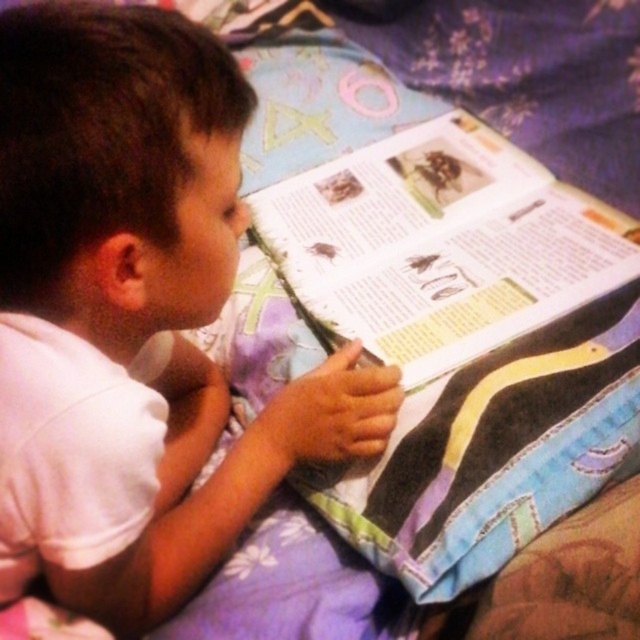
In order to click on white matte shirt at upper left in this screenshot , I will do `click(150, 276)`.

Which of these two, white matte shirt at upper left or paperback book at center, stands taller?

With more height is white matte shirt at upper left.

Who is more forward, (326, 451) or (413, 224)?

Point (326, 451)

At what (x,y) coordinates should I click in order to perform the action: click on white matte shirt at upper left. Please return your answer as a coordinate pair (x, y). Looking at the image, I should click on (150, 276).